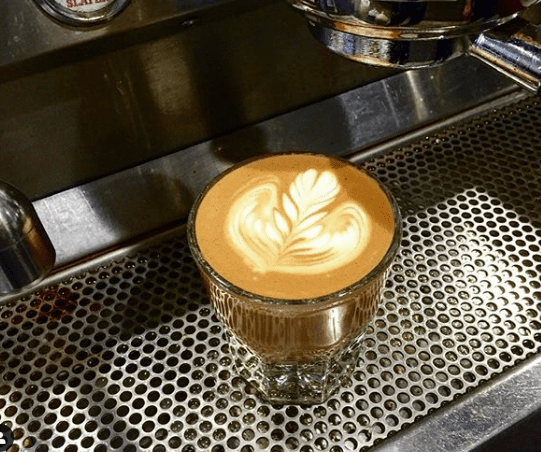
Image resolution: width=541 pixels, height=452 pixels. In order to click on glass in this screenshot , I will do `click(273, 354)`.